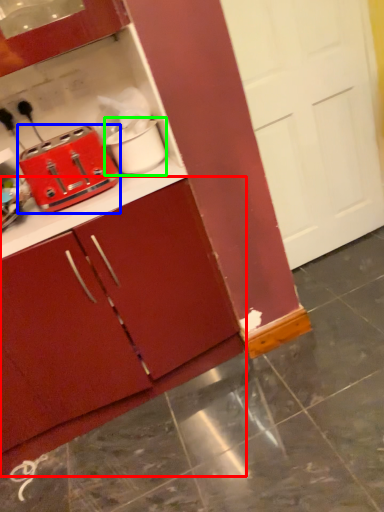
Question: Based on their relative distances, which object is nearer to cabinetry (highlighted by a red box)? Choose from toaster (highlighted by a blue box) and appliance (highlighted by a green box).

Choices:
 (A) toaster
 (B) appliance

Answer: (A)